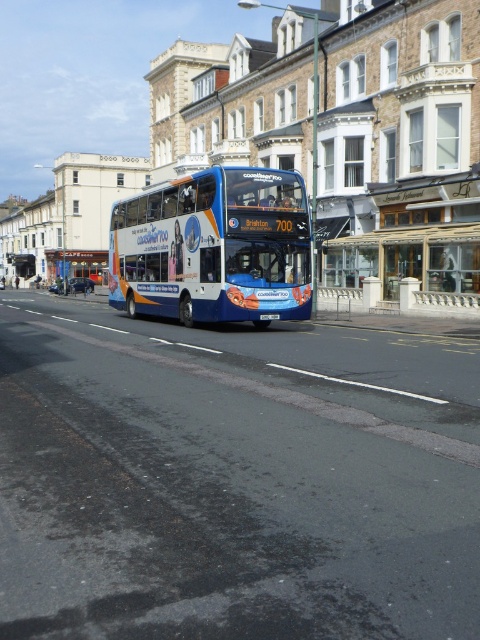
Does blue metallic bus at center lie in front of black plastic license plate at center?

Yes, blue metallic bus at center is in front of black plastic license plate at center.

Image resolution: width=480 pixels, height=640 pixels. In order to click on blue metallic bus at center in this screenshot , I will do click(214, 248).

Is point (230, 305) positioned before point (266, 317)?

Yes.

Identify the location of blue metallic bus at center. The image size is (480, 640). (214, 248).